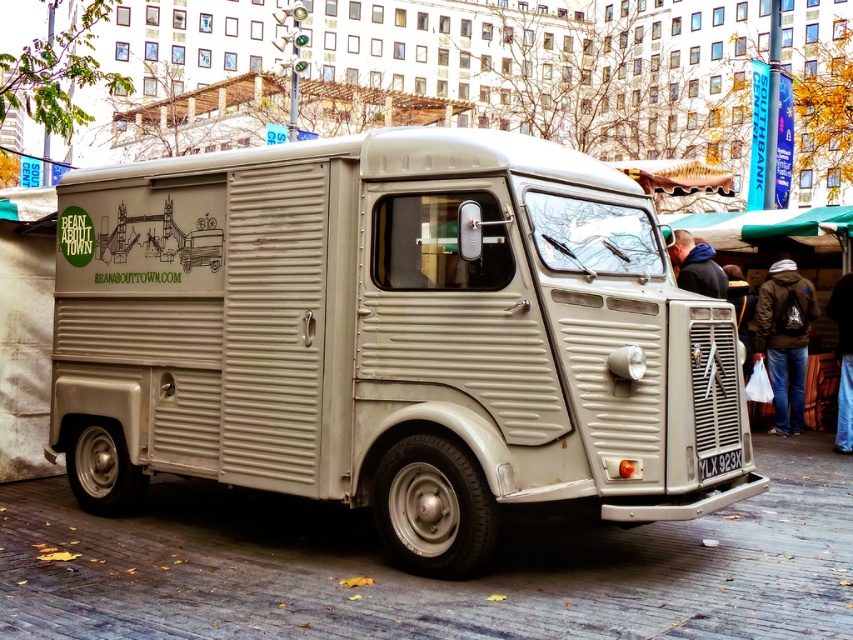
You are standing in front of the vintage Citroen HY van. There is a pair of denim pants at lower right. Where exactly are the denim pants located relative to the van?

The denim pants at lower right are located at the coordinates point (x=843, y=358) relative to the van.

Consider the image. You are standing at the entrance of the market and want to find the matte beige van at center. According to the map, where should you look?

The matte beige van at center is located at the coordinates point (390, 337).

You are a delivery person who needs to secure a dark brown backpack at lower right and a blue fleece jacket at upper right on the roof of the Citroenet Type HY van. Which item should you place first to ensure proper weight distribution?

You should place the blue fleece jacket at upper right first because the dark brown backpack at lower right is to the right of it, so placing the jacket closer to the center will help balance the weight better.